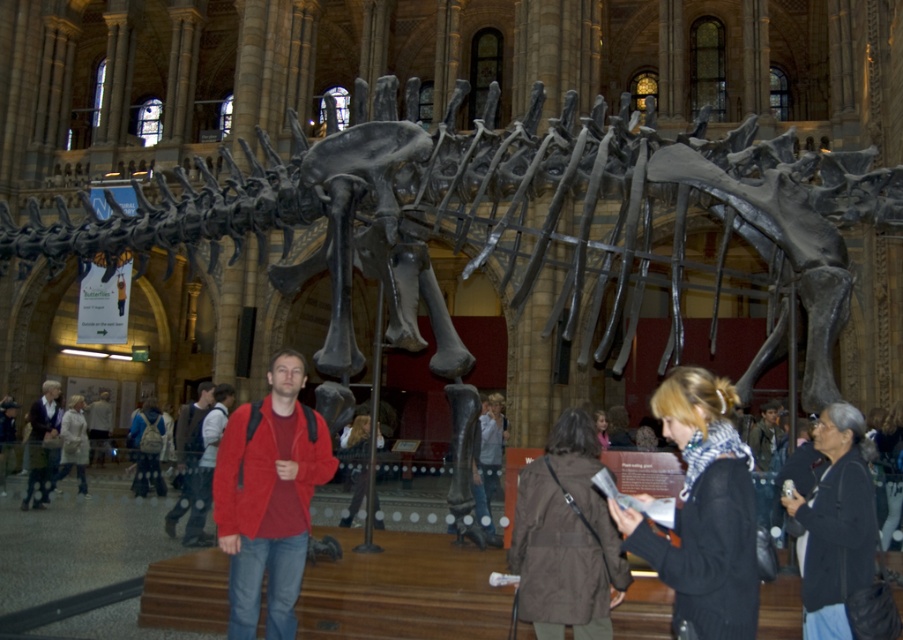
Question: Does dark blue sweater at lower left have a greater width compared to red sweater at center?

Choices:
 (A) yes
 (B) no

Answer: (A)

Question: Which of the following is the farthest from the observer?

Choices:
 (A) red jacket at center
 (B) brown fabric coat at lower center
 (C) white cotton coat at center
 (D) dark gray backpack at lower left

Answer: (C)

Question: Is suede red jacket at center positioned behind dark blue sweater at lower left?

Choices:
 (A) no
 (B) yes

Answer: (A)

Question: Among these points, which one is farthest from the camera?

Choices:
 (A) (569, 467)
 (B) (54, 413)
 (C) (213, 433)

Answer: (B)

Question: Among these objects, which one is farthest from the camera?

Choices:
 (A) red jacket at center
 (B) white cotton coat at center
 (C) denim jacket at center
 (D) brown fabric coat at lower center

Answer: (B)

Question: Does black scarf at center appear over brown fabric coat at lower center?

Choices:
 (A) no
 (B) yes

Answer: (A)